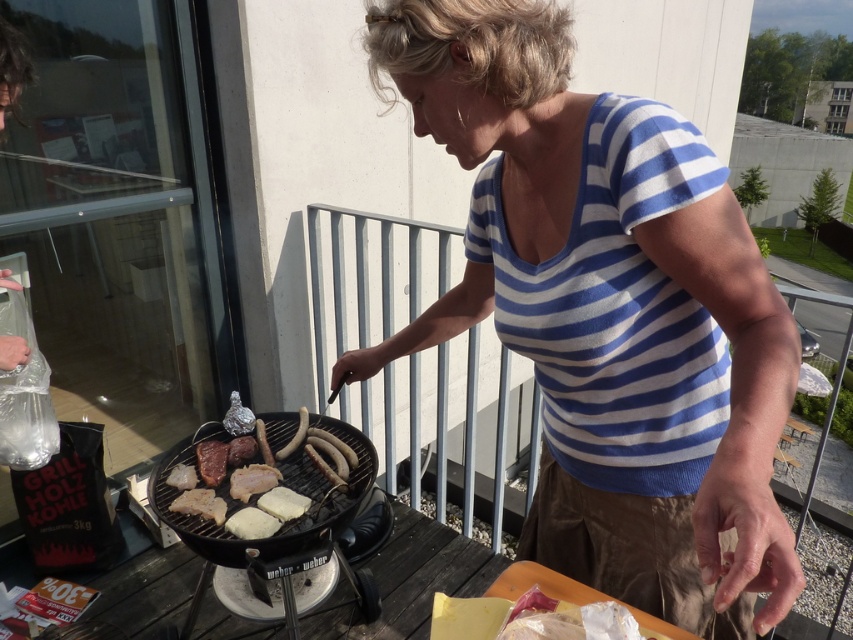
Consider the image. Does blue striped shirt at center appear on the right side of black matte barbecue grill at center?

Yes, blue striped shirt at center is to the right of black matte barbecue grill at center.

Is point (483, 84) behind point (375, 602)?

No, (483, 84) is in front of (375, 602).

Is point (709, 262) positioned before point (265, 576)?

That is True.

At what (x,y) coordinates should I click in order to perform the action: click on blue striped shirt at center. Please return your answer as a coordinate pair (x, y). The image size is (853, 640). Looking at the image, I should click on (607, 312).

Does blue striped shirt at center have a lesser width compared to grilled meat and sausages at center?

In fact, blue striped shirt at center might be wider than grilled meat and sausages at center.

Is blue striped shirt at center to the right of grilled meat and sausages at center from the viewer's perspective?

Indeed, blue striped shirt at center is positioned on the right side of grilled meat and sausages at center.

The height and width of the screenshot is (640, 853). I want to click on blue striped shirt at center, so click(x=607, y=312).

Locate an element on the screen. The image size is (853, 640). blue striped shirt at center is located at coordinates (607, 312).

Which of these two, black matte barbecue grill at center or white matte bread at center, stands shorter?

Standing shorter between the two is white matte bread at center.

Is point (357, 429) farther from camera compared to point (265, 490)?

Yes, point (357, 429) is behind point (265, 490).

Is point (195, 545) more distant than point (241, 481)?

No, (195, 545) is closer to viewer.

Where is `black matte barbecue grill at center`? This screenshot has height=640, width=853. black matte barbecue grill at center is located at coordinates (280, 524).